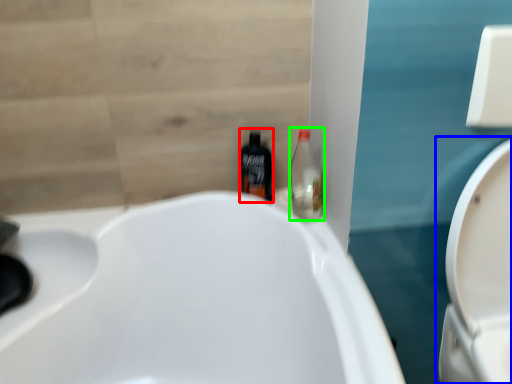
Question: Based on their relative distances, which object is farther from bottle (highlighted by a red box)? Choose from toilet (highlighted by a blue box) and bottle (highlighted by a green box).

Choices:
 (A) toilet
 (B) bottle

Answer: (A)